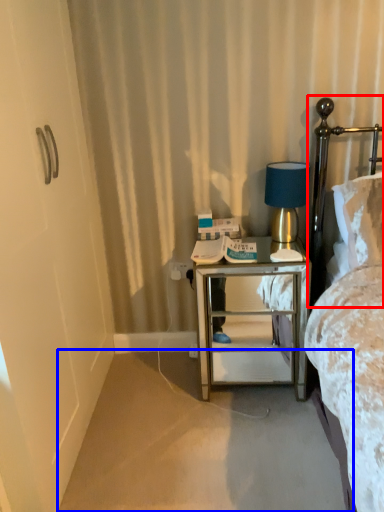
Question: Which point is further to the camera, headboard (highlighted by a red box) or plain (highlighted by a blue box)?

Choices:
 (A) headboard
 (B) plain

Answer: (A)